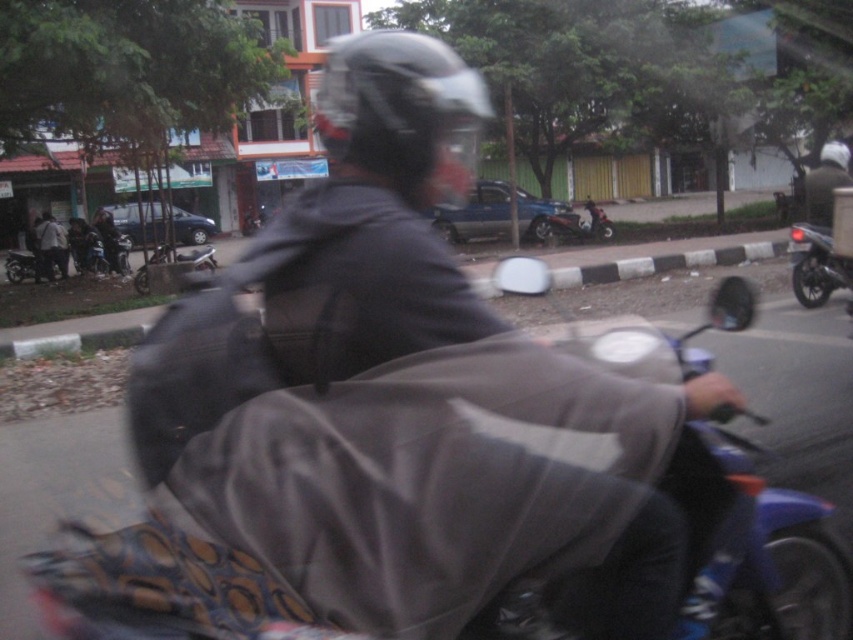
You are a delivery person who needs to check if your glossy black helmet at center is blocking the view of your metallic silver scooter at center. According to the scene, is the helmet obscuring the scooter?

The glossy black helmet at center is in front of the metallic silver scooter at center, so the helmet is blocking the view of the scooter.

You are a delivery person who needs to carry a package that is as wide as the glossy black helmet at center. Can the blue plastic motorcycle at center fit the package on its backseat without exceeding its width?

The blue plastic motorcycle at center has a width less than the glossy black helmet at center. Since the package is as wide as the helmet, it would be wider than the motorcycle itself, making it impossible to fit on the backseat without exceeding its width.

You are a photographer trying to capture a clear shot of the blue plastic motorcycle at center and the glossy black helmet at center. Since you want to focus on the motorcycle first, which object should you adjust your camera to prioritize in terms of depth of field?

The blue plastic motorcycle at center is closer to the viewer than the glossy black helmet at center, so you should adjust the camera to prioritize the blue plastic motorcycle at center in the depth of field to ensure it is in focus first.